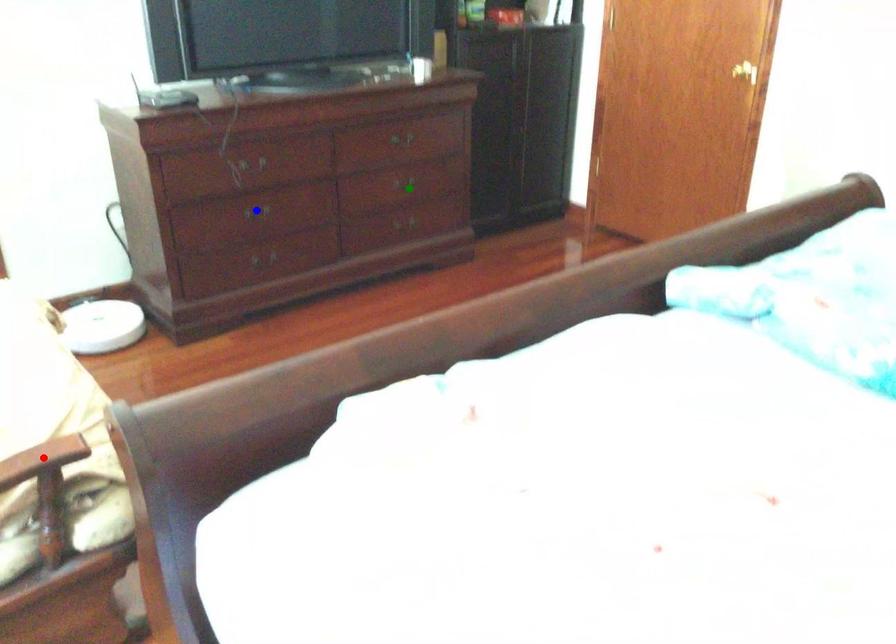
Order these from nearest to farthest:
A) green point
B) blue point
C) red point

red point → blue point → green point